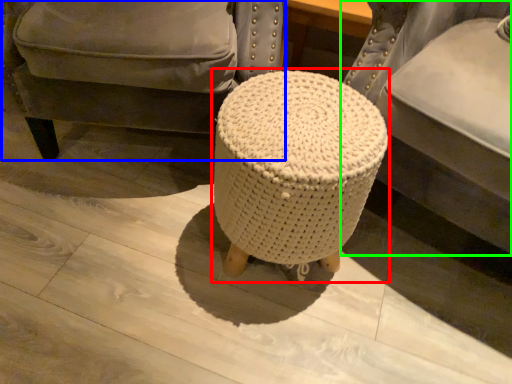
Question: Based on their relative distances, which object is nearer to bar stool (highlighted by a red box)? Choose from chair (highlighted by a blue box) and furniture (highlighted by a green box).

Choices:
 (A) chair
 (B) furniture

Answer: (B)